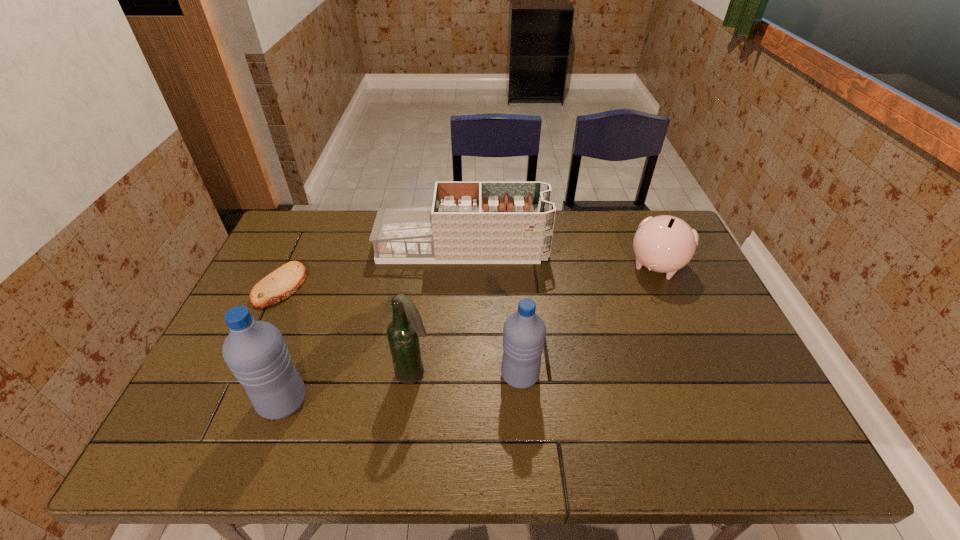
The image size is (960, 540). Identify the location of vacant space that satisfies the following two spatial constraints: 1. on the back side of the piggy bank; 2. on the left side of the taller water bottle. (333, 266).

Find the location of `vacant region that satisfies the following two spatial constraints: 1. at the entrance of the shorter water bottle; 2. on the right side of the dollhouse`. vacant region that satisfies the following two spatial constraints: 1. at the entrance of the shorter water bottle; 2. on the right side of the dollhouse is located at coordinates (457, 375).

At what (x,y) coordinates should I click in order to perform the action: click on free spot that satisfies the following two spatial constraints: 1. at the entrance of the rightmost object; 2. on the left side of the dollhouse. Please return your answer as a coordinate pair (x, y). The height and width of the screenshot is (540, 960). Looking at the image, I should click on (462, 266).

The image size is (960, 540). Find the location of `free spot that satisfies the following two spatial constraints: 1. on the back side of the piggy bank; 2. at the entrance of the dollhouse`. free spot that satisfies the following two spatial constraints: 1. on the back side of the piggy bank; 2. at the entrance of the dollhouse is located at coordinates (648, 247).

At what (x,y) coordinates should I click in order to perform the action: click on vacant region that satisfies the following two spatial constraints: 1. at the entrance of the dollhouse; 2. on the left side of the shorter water bottle. Please return your answer as a coordinate pair (x, y). Looking at the image, I should click on (457, 375).

Where is `vacant space that satisfies the following two spatial constraints: 1. at the entrance of the dollhouse; 2. on the front side of the left water bottle`? This screenshot has height=540, width=960. vacant space that satisfies the following two spatial constraints: 1. at the entrance of the dollhouse; 2. on the front side of the left water bottle is located at coordinates (456, 401).